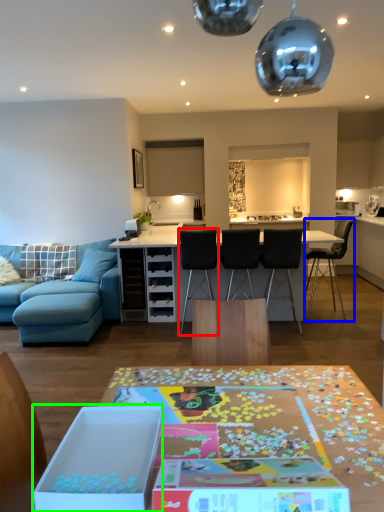
Question: Based on their relative distances, which object is nearer to chair (highlighted by a red box)? Choose from chair (highlighted by a blue box) and cardboard box (highlighted by a green box).

Choices:
 (A) chair
 (B) cardboard box

Answer: (A)